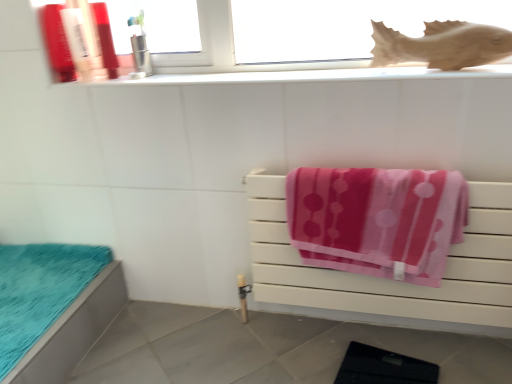
Question: Considering the relative sizes of brown matte fish at upper right and pink soft towel at center right in the image provided, is brown matte fish at upper right thinner than pink soft towel at center right?

Choices:
 (A) yes
 (B) no

Answer: (A)

Question: Is brown matte fish at upper right looking in the opposite direction of pink soft towel at center right?

Choices:
 (A) yes
 (B) no

Answer: (B)

Question: Considering the relative sizes of brown matte fish at upper right and pink soft towel at center right in the image provided, is brown matte fish at upper right wider than pink soft towel at center right?

Choices:
 (A) no
 (B) yes

Answer: (A)

Question: Is brown matte fish at upper right oriented towards pink soft towel at center right?

Choices:
 (A) yes
 (B) no

Answer: (B)

Question: Is the depth of brown matte fish at upper right greater than that of pink soft towel at center right?

Choices:
 (A) yes
 (B) no

Answer: (A)

Question: Considering the positions of brown matte fish at upper right and matte plastic bottle at upper left, the first toiletry when ordered from left to right, in the image, is brown matte fish at upper right wider or thinner than matte plastic bottle at upper left, the first toiletry when ordered from left to right,?

Choices:
 (A) thin
 (B) wide

Answer: (A)

Question: Is point (484, 59) positioned closer to the camera than point (53, 23)?

Choices:
 (A) farther
 (B) closer

Answer: (B)

Question: Is brown matte fish at upper right in front of or behind matte plastic bottle at upper left, acting as the 4th toiletry starting from the right, in the image?

Choices:
 (A) front
 (B) behind

Answer: (A)

Question: From a real-world perspective, relative to matte plastic bottle at upper left, the first toiletry when ordered from left to right, is brown matte fish at upper right vertically above or below?

Choices:
 (A) below
 (B) above

Answer: (A)

Question: From the image's perspective, relative to brown matte fish at upper right, is white glossy window sill at upper center above or below?

Choices:
 (A) above
 (B) below

Answer: (B)

Question: Looking at the image, does white glossy window sill at upper center seem bigger or smaller compared to brown matte fish at upper right?

Choices:
 (A) small
 (B) big

Answer: (B)

Question: Considering the positions of point (467, 72) and point (461, 26), is point (467, 72) closer or farther from the camera than point (461, 26)?

Choices:
 (A) farther
 (B) closer

Answer: (B)

Question: Relative to brown matte fish at upper right, is white glossy window sill at upper center in front or behind?

Choices:
 (A) behind
 (B) front

Answer: (A)

Question: Would you say white glossy window sill at upper center is inside or outside matte plastic bottle at upper left, marked as the third toiletry in a right-to-left arrangement?

Choices:
 (A) outside
 (B) inside

Answer: (A)

Question: In the image, is white glossy window sill at upper center on the left side or the right side of matte plastic bottle at upper left, marked as the 2th toiletry in a left-to-right arrangement?

Choices:
 (A) left
 (B) right

Answer: (B)